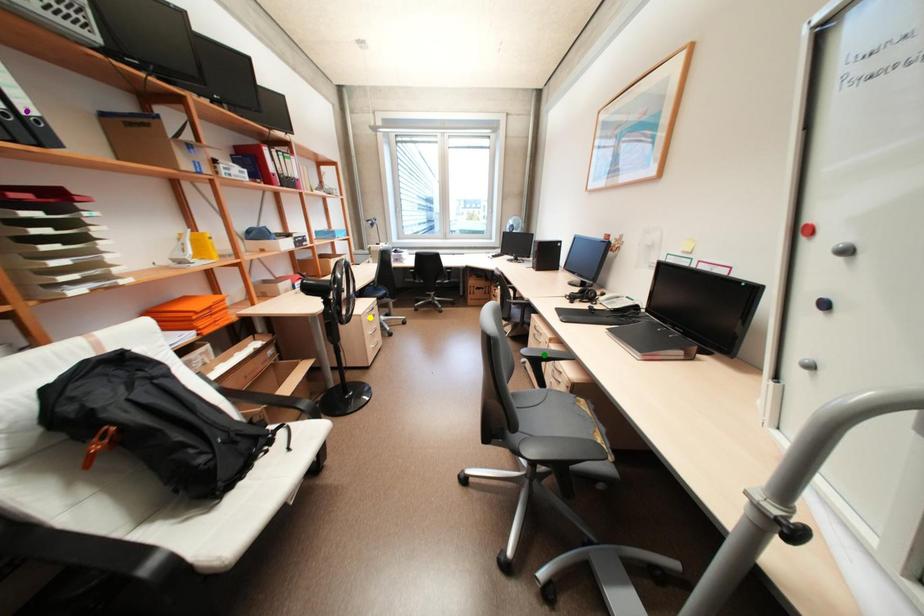
Order these from nearest to farthest:
green point, purple point, yellow point

yellow point
green point
purple point